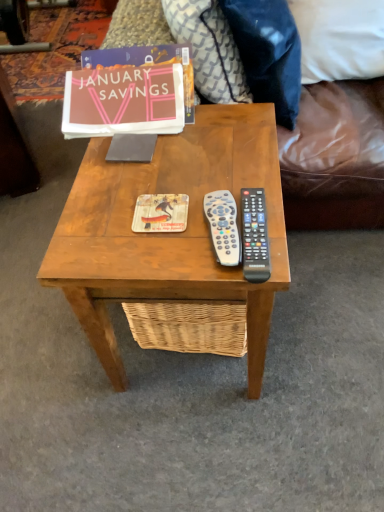
Identify the location of free space to the back side of matte paper book cover at center. This screenshot has height=512, width=384. [166, 161].